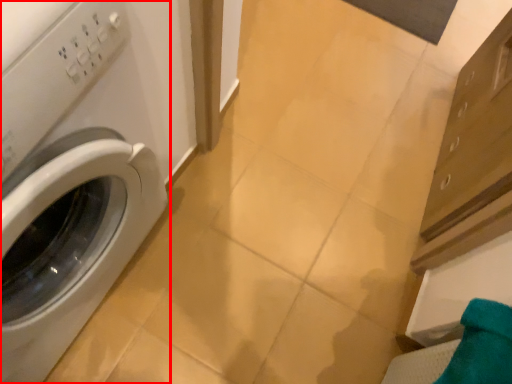
Question: Considering the relative positions of washing machine (annotated by the red box) and bath towel in the image provided, where is washing machine (annotated by the red box) located with respect to the staircase?

Choices:
 (A) right
 (B) left

Answer: (B)